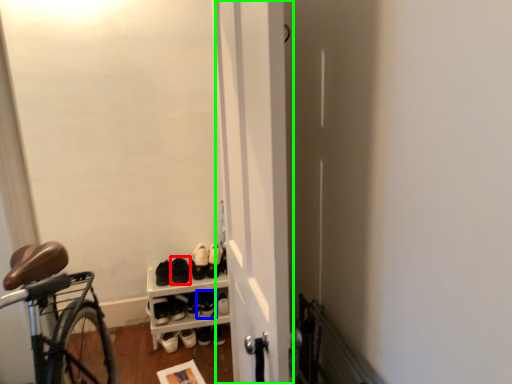
Question: Which object is the closest to the footwear (highlighted by a red box)? Choose among these: footwear (highlighted by a blue box) or door (highlighted by a green box).

Choices:
 (A) footwear
 (B) door

Answer: (A)